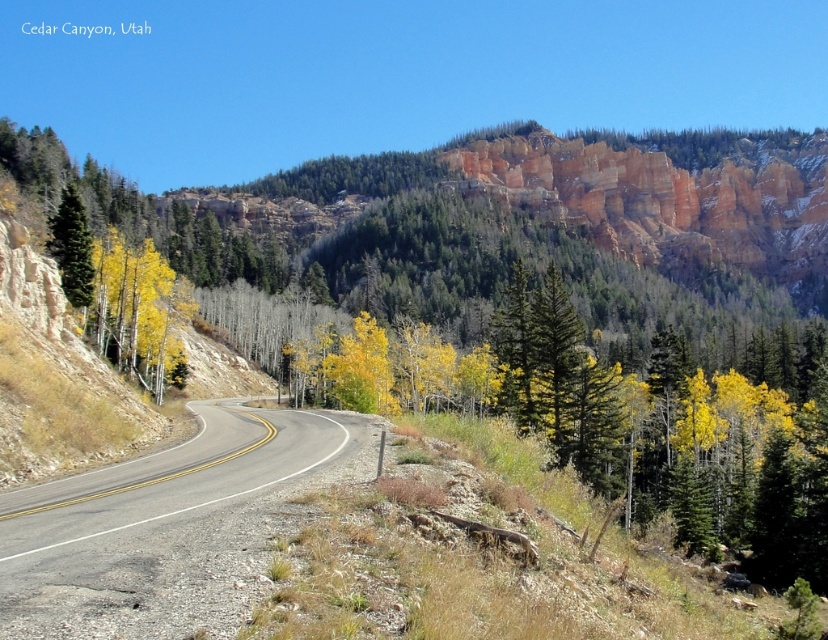
Does yellow-green foliage at center come in front of green matte tree at left?

Yes, yellow-green foliage at center is in front of green matte tree at left.

Is point (516, 244) more distant than point (65, 273)?

Yes, point (516, 244) is farther from viewer.

Between point (657, 209) and point (68, 234), which one is positioned in front?

Point (68, 234) is more forward.

This screenshot has width=828, height=640. In order to click on yellow-green foliage at center in this screenshot , I will do `click(520, 241)`.

Looking at this image, can you confirm if yellow-green foliage at center is taller than asphalt road at center?

Indeed, yellow-green foliage at center has a greater height compared to asphalt road at center.

Image resolution: width=828 pixels, height=640 pixels. What are the coordinates of `yellow-green foliage at center` in the screenshot? It's located at (520, 241).

Which is behind, point (161, 538) or point (76, 221)?

Positioned behind is point (76, 221).

Is asphalt road at center bigger than green matte tree at left?

No.

The width and height of the screenshot is (828, 640). Identify the location of asphalt road at center. (166, 525).

In order to click on asphalt road at center in this screenshot , I will do `click(166, 525)`.